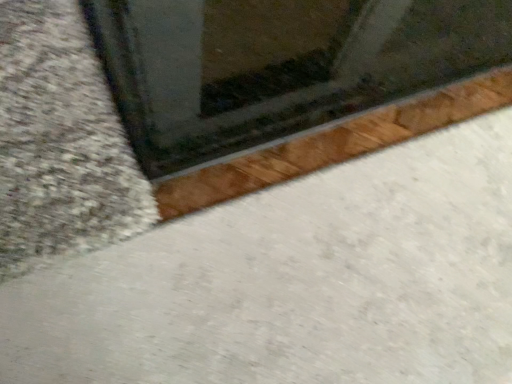
The height and width of the screenshot is (384, 512). What do you see at coordinates (296, 281) in the screenshot? I see `white smooth concrete at lower left` at bounding box center [296, 281].

Where is `white smooth concrete at lower left`? The height and width of the screenshot is (384, 512). white smooth concrete at lower left is located at coordinates (296, 281).

Based on the photo, measure the distance between point (347,328) and camera.

Point (347,328) is 37.87 inches from camera.

The width and height of the screenshot is (512, 384). What do you see at coordinates (278, 65) in the screenshot?
I see `transparent glass window at upper center` at bounding box center [278, 65].

I want to click on transparent glass window at upper center, so click(278, 65).

The height and width of the screenshot is (384, 512). Identify the location of white smooth concrete at lower left. (296, 281).

Which is more to the right, transparent glass window at upper center or white smooth concrete at lower left?

Positioned to the right is transparent glass window at upper center.

Relative to white smooth concrete at lower left, is transparent glass window at upper center in front or behind?

transparent glass window at upper center is positioned farther from the viewer than white smooth concrete at lower left.

Which is nearer, (x=227, y=40) or (x=165, y=346)?

The point (x=165, y=346) is closer to the camera.

From the image's perspective, which one is positioned higher, transparent glass window at upper center or white smooth concrete at lower left?

From the image's view, transparent glass window at upper center is above.

From a real-world perspective, who is located lower, transparent glass window at upper center or white smooth concrete at lower left?

white smooth concrete at lower left, from a real-world perspective.

Which object is wider, transparent glass window at upper center or white smooth concrete at lower left?

white smooth concrete at lower left.

Who is shorter, transparent glass window at upper center or white smooth concrete at lower left?

Standing shorter between the two is white smooth concrete at lower left.

Considering the sizes of objects transparent glass window at upper center and white smooth concrete at lower left in the image provided, who is bigger, transparent glass window at upper center or white smooth concrete at lower left?

transparent glass window at upper center is bigger.

Do you think transparent glass window at upper center is within white smooth concrete at lower left, or outside of it?

transparent glass window at upper center is not inside white smooth concrete at lower left, it's outside.

Is there a large distance between transparent glass window at upper center and white smooth concrete at lower left?

They are positioned close to each other.

Is transparent glass window at upper center turned away from white smooth concrete at lower left?

No, transparent glass window at upper center's orientation is not away from white smooth concrete at lower left.

How different are the orientations of transparent glass window at upper center and white smooth concrete at lower left in degrees?

The facing directions of transparent glass window at upper center and white smooth concrete at lower left are 180 degrees apart.

Measure the distance from transparent glass window at upper center to white smooth concrete at lower left.

transparent glass window at upper center is 14.25 inches away from white smooth concrete at lower left.

You are a GUI agent. You are given a task and a screenshot of the screen. Output one action in this format:
    pyautogui.click(x=<x>, y=<y>)
    Task: Click on the concrete below the transparent glass window at upper center (from the image's perspective)
    This screenshot has width=512, height=384.
    Given the screenshot: What is the action you would take?
    pyautogui.click(x=296, y=281)

Considering the positions of objects white smooth concrete at lower left and transparent glass window at upper center in the image provided, who is more to the left, white smooth concrete at lower left or transparent glass window at upper center?

From the viewer's perspective, white smooth concrete at lower left appears more on the left side.

Considering the relative positions of white smooth concrete at lower left and transparent glass window at upper center in the image provided, is white smooth concrete at lower left in front of transparent glass window at upper center?

Yes, the depth of white smooth concrete at lower left is less than that of transparent glass window at upper center.

Which point is more distant from viewer, (271, 264) or (441, 56)?

The point (441, 56) is farther.

From the image's perspective, who appears lower, white smooth concrete at lower left or transparent glass window at upper center?

From the image's view, white smooth concrete at lower left is below.

From a real-world perspective, is white smooth concrete at lower left beneath transparent glass window at upper center?

Yes, from a real-world perspective, white smooth concrete at lower left is under transparent glass window at upper center.

Considering the sizes of objects white smooth concrete at lower left and transparent glass window at upper center in the image provided, who is thinner, white smooth concrete at lower left or transparent glass window at upper center?

transparent glass window at upper center is thinner.

Can you confirm if white smooth concrete at lower left is shorter than transparent glass window at upper center?

Yes, white smooth concrete at lower left is shorter than transparent glass window at upper center.

In terms of size, does white smooth concrete at lower left appear bigger or smaller than transparent glass window at upper center?

In the image, white smooth concrete at lower left appears to be smaller than transparent glass window at upper center.

Is white smooth concrete at lower left situated inside transparent glass window at upper center or outside?

white smooth concrete at lower left cannot be found inside transparent glass window at upper center.

Are white smooth concrete at lower left and transparent glass window at upper center far apart?

No, white smooth concrete at lower left is not far away from transparent glass window at upper center.

Is white smooth concrete at lower left oriented towards transparent glass window at upper center?

No.

What's the angular difference between white smooth concrete at lower left and transparent glass window at upper center's facing directions?

The angular difference between white smooth concrete at lower left and transparent glass window at upper center is 180 degrees.

Consider the image. Measure the distance between white smooth concrete at lower left and transparent glass window at upper center.

white smooth concrete at lower left and transparent glass window at upper center are 36.19 centimeters apart from each other.

I want to click on window above the white smooth concrete at lower left (from a real-world perspective), so click(278, 65).

This screenshot has height=384, width=512. I want to click on concrete that is below the transparent glass window at upper center (from the image's perspective), so pos(296,281).

The image size is (512, 384). What are the coordinates of `concrete that appears on the left of transparent glass window at upper center` in the screenshot? It's located at (296, 281).